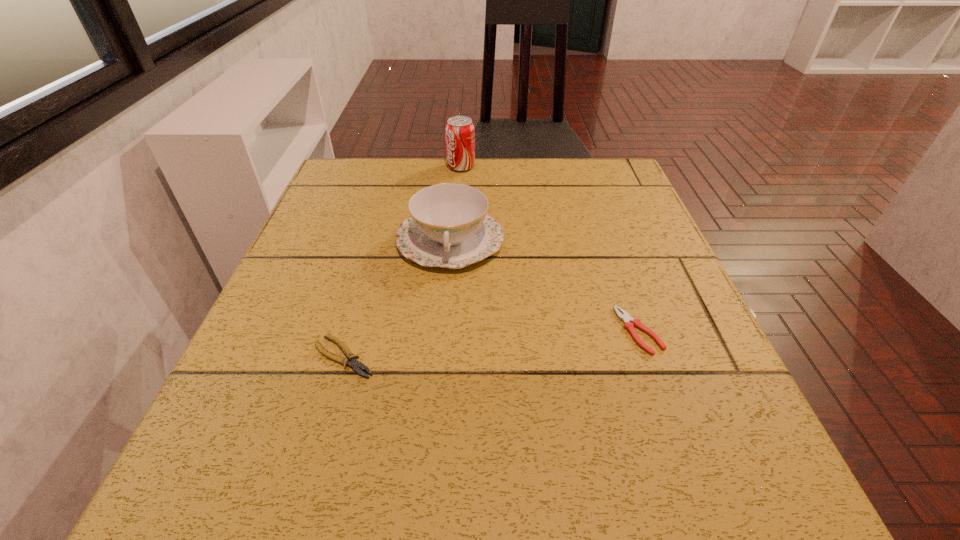
Locate an element on the screen. This screenshot has width=960, height=540. object present at the far edge is located at coordinates (460, 134).

At what (x,y) coordinates should I click in order to perform the action: click on object at the left edge. Please return your answer as a coordinate pair (x, y). Looking at the image, I should click on (355, 364).

Find the location of `object at the right edge`. object at the right edge is located at coordinates (629, 323).

Find the location of a particular element. free space at the far edge of the desktop is located at coordinates (562, 169).

I want to click on vacant region at the near edge of the desktop, so click(x=482, y=480).

The height and width of the screenshot is (540, 960). Identify the location of vacant area at the left edge. (347, 255).

What are the coordinates of `vacant space at the right edge` in the screenshot? It's located at (594, 272).

The height and width of the screenshot is (540, 960). Identify the location of free space at the far left corner of the desktop. (367, 176).

Locate an element on the screen. This screenshot has height=540, width=960. free region at the far right corner of the desktop is located at coordinates (621, 163).

At what (x,y) coordinates should I click in order to perform the action: click on vacant area that lies between the third nearest object and the rightmost object. Please return your answer as a coordinate pair (x, y). The width and height of the screenshot is (960, 540). Looking at the image, I should click on (544, 286).